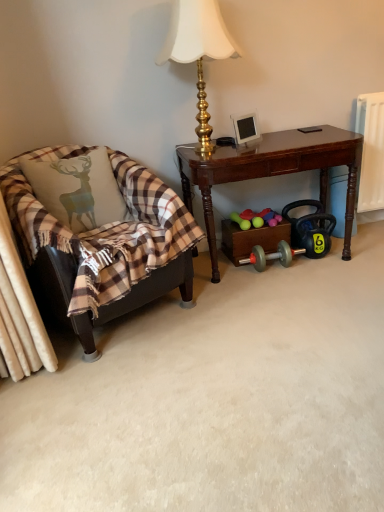
Question: Considering the relative sizes of plaid fabric chair at left and plaid fabric pillow at left in the image provided, is plaid fabric chair at left wider than plaid fabric pillow at left?

Choices:
 (A) yes
 (B) no

Answer: (A)

Question: Is plaid fabric chair at left bigger than plaid fabric pillow at left?

Choices:
 (A) yes
 (B) no

Answer: (A)

Question: Can you confirm if plaid fabric chair at left is taller than plaid fabric pillow at left?

Choices:
 (A) yes
 (B) no

Answer: (A)

Question: Is plaid fabric chair at left touching plaid fabric pillow at left?

Choices:
 (A) yes
 (B) no

Answer: (B)

Question: Is plaid fabric chair at left shorter than plaid fabric pillow at left?

Choices:
 (A) no
 (B) yes

Answer: (A)

Question: Would you say plaid fabric chair at left is a long distance from plaid fabric pillow at left?

Choices:
 (A) no
 (B) yes

Answer: (A)

Question: Can you confirm if plaid fabric pillow at left is taller than gold metallic lamp at upper center?

Choices:
 (A) yes
 (B) no

Answer: (B)

Question: From a real-world perspective, is plaid fabric pillow at left located beneath gold metallic lamp at upper center?

Choices:
 (A) yes
 (B) no

Answer: (A)

Question: Does plaid fabric pillow at left have a lesser width compared to gold metallic lamp at upper center?

Choices:
 (A) yes
 (B) no

Answer: (A)

Question: Would you say plaid fabric pillow at left is a long distance from gold metallic lamp at upper center?

Choices:
 (A) no
 (B) yes

Answer: (A)

Question: Is plaid fabric pillow at left smaller than gold metallic lamp at upper center?

Choices:
 (A) no
 (B) yes

Answer: (B)

Question: Is the surface of plaid fabric pillow at left in direct contact with gold metallic lamp at upper center?

Choices:
 (A) yes
 (B) no

Answer: (B)

Question: Can plaid fabric chair at left be found inside plaid fabric pillow at left?

Choices:
 (A) yes
 (B) no

Answer: (B)